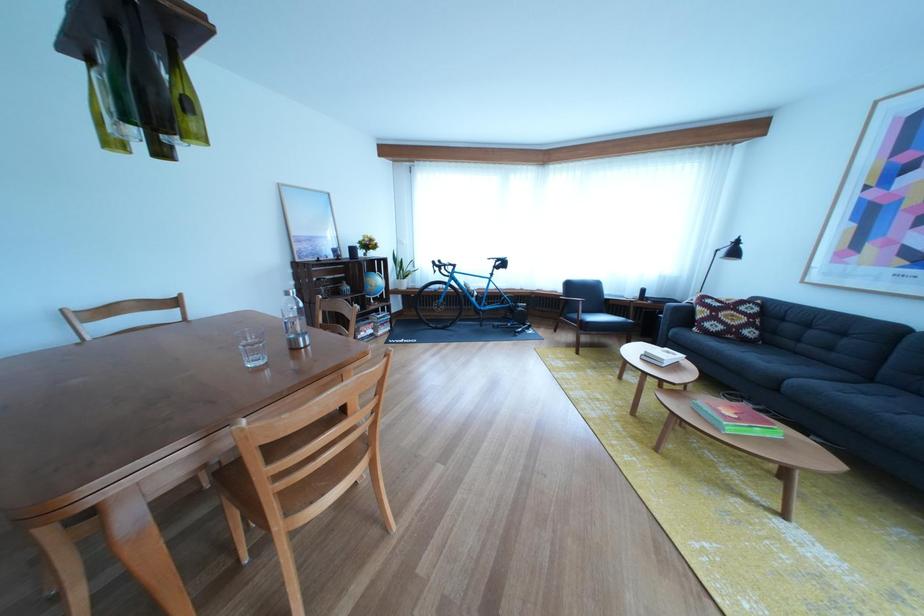
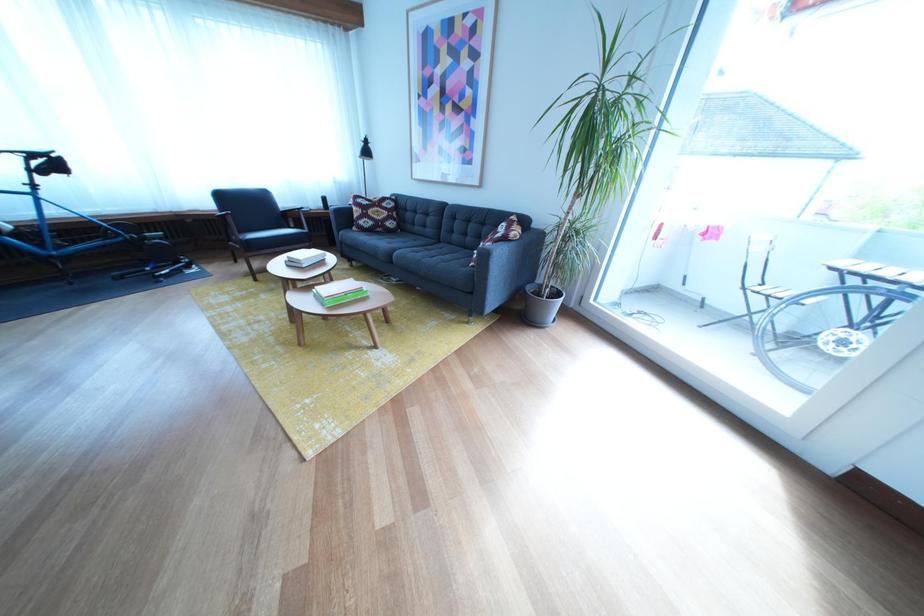
In the second image, find the point that corresponds to point 516,270 in the first image.

(64, 169)